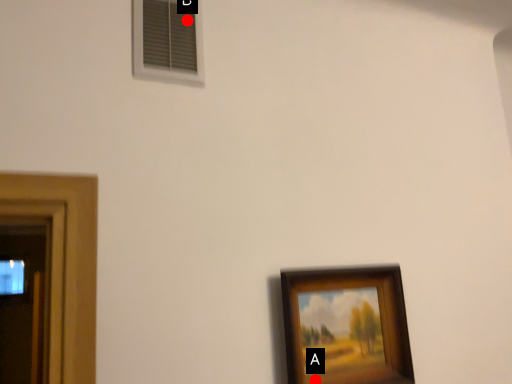
Question: Two points are circled on the image, labeled by A and B beside each circle. Which point is farther to the camera?

Choices:
 (A) A is further
 (B) B is further

Answer: (B)